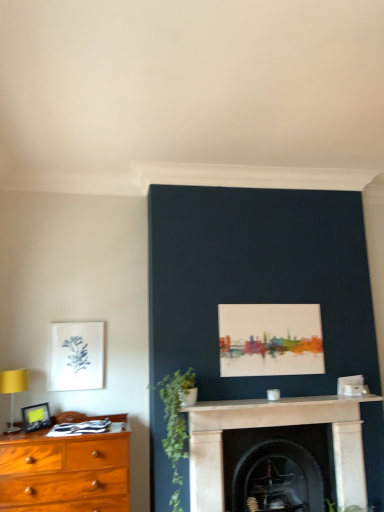
Question: From the image's perspective, would you say green matte plant at center-left is positioned over white marble fireplace at center, which appears as the 2th fireplace when viewed from the back?

Choices:
 (A) yes
 (B) no

Answer: (A)

Question: From a real-world perspective, is green matte plant at center-left on white marble fireplace at center, which appears as the 2th fireplace when viewed from the back?

Choices:
 (A) yes
 (B) no

Answer: (A)

Question: Considering the relative sizes of green matte plant at center-left and white marble fireplace at center, marked as the first fireplace in a front-to-back arrangement, in the image provided, is green matte plant at center-left smaller than white marble fireplace at center, marked as the first fireplace in a front-to-back arrangement,?

Choices:
 (A) yes
 (B) no

Answer: (B)

Question: Is green matte plant at center-left oriented towards white marble fireplace at center, marked as the first fireplace in a front-to-back arrangement?

Choices:
 (A) yes
 (B) no

Answer: (B)

Question: Is green matte plant at center-left further to the viewer compared to white marble fireplace at center, which appears as the 2th fireplace when viewed from the back?

Choices:
 (A) no
 (B) yes

Answer: (A)

Question: From the image's perspective, is green matte plant at center-left beneath white marble fireplace at center, which appears as the 2th fireplace when viewed from the back?

Choices:
 (A) yes
 (B) no

Answer: (B)

Question: Is matte black picture frame at left, arranged as the second picture frame when viewed from the back, inside white marble mantle at center?

Choices:
 (A) yes
 (B) no

Answer: (B)

Question: Does white marble mantle at center have a lesser height compared to matte black picture frame at left, which is the 1th picture frame from bottom to top?

Choices:
 (A) yes
 (B) no

Answer: (A)

Question: From a real-world perspective, is white marble mantle at center over matte black picture frame at left, the 2th picture frame when ordered from top to bottom?

Choices:
 (A) yes
 (B) no

Answer: (A)

Question: Are white marble mantle at center and matte black picture frame at left, arranged as the second picture frame when viewed from the back, making contact?

Choices:
 (A) no
 (B) yes

Answer: (A)

Question: Is white marble mantle at center in front of matte black picture frame at left, which is the 1th picture frame from front to back?

Choices:
 (A) no
 (B) yes

Answer: (B)

Question: Is there a large distance between white marble mantle at center and matte black picture frame at left, which is the 1th picture frame from front to back?

Choices:
 (A) no
 (B) yes

Answer: (B)

Question: From a real-world perspective, is white marble mantle at center located beneath green matte plant at center-left?

Choices:
 (A) no
 (B) yes

Answer: (A)